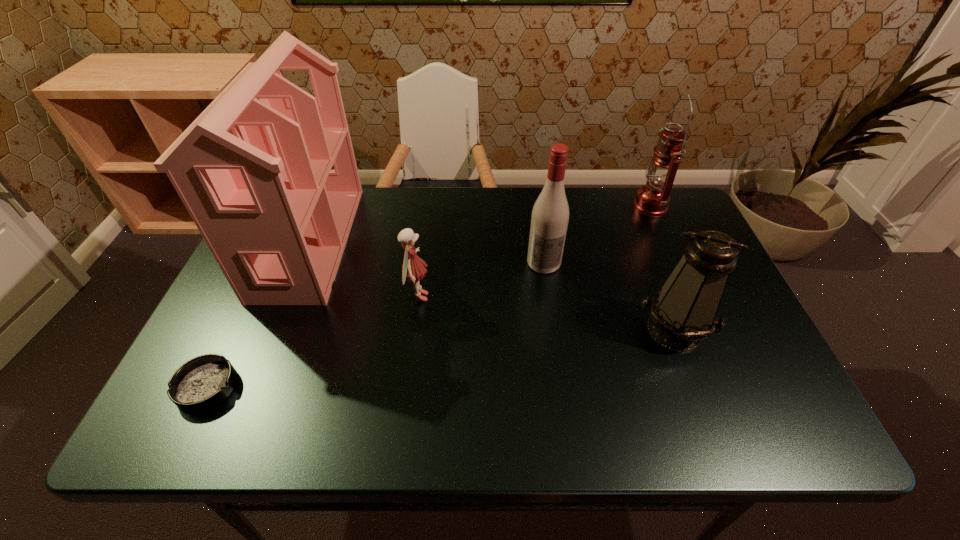
You are a GUI agent. You are given a task and a screenshot of the screen. Output one action in this format:
    pyautogui.click(x=<x>, y=<y>)
    Task: Click on the free region located on the left of the farther oil lamp
    This screenshot has height=540, width=960.
    Given the screenshot: What is the action you would take?
    pyautogui.click(x=549, y=206)

The image size is (960, 540). I want to click on vacant space located on the label of the alcohol, so tap(561, 382).

Image resolution: width=960 pixels, height=540 pixels. I want to click on free space located 0.080m on the left of the nearer oil lamp, so click(x=604, y=329).

At what (x,y) coordinates should I click in order to perform the action: click on vacant area situated on the front-facing side of the fifth tallest object. Please return your answer as a coordinate pair (x, y). The width and height of the screenshot is (960, 540). Looking at the image, I should click on coord(542,296).

Where is `free space located on the back of the nearest object`? free space located on the back of the nearest object is located at coordinates (229, 340).

Image resolution: width=960 pixels, height=540 pixels. I want to click on dollhouse that is at the far edge, so click(253, 170).

I want to click on oil lamp at the far edge, so click(x=652, y=200).

Locate an element on the screen. object located at the near edge is located at coordinates (202, 383).

Identify the location of dollhouse present at the left edge. This screenshot has width=960, height=540. (253, 170).

Identify the location of ashtray that is at the left edge. (202, 383).